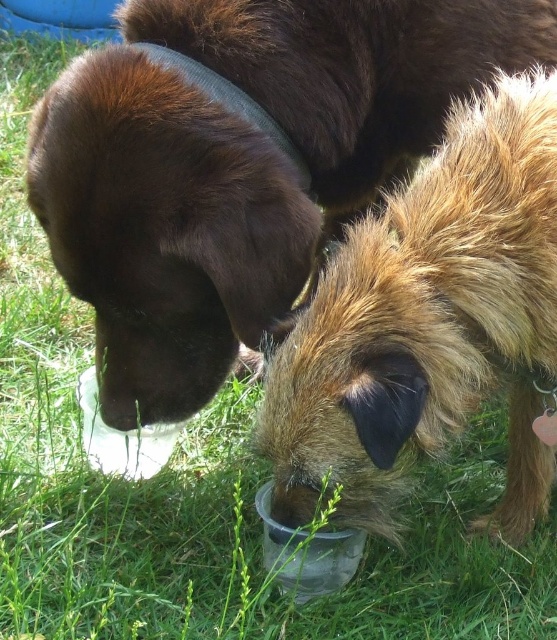
Between brown matte fur at center and fuzzy brown fur at lower center, which one is positioned higher?

Positioned higher is brown matte fur at center.

From the picture: Between brown matte fur at center and fuzzy brown fur at lower center, which one appears on the right side from the viewer's perspective?

From the viewer's perspective, fuzzy brown fur at lower center appears more on the right side.

Between point (236, 33) and point (388, 244), which one is positioned in front?

Point (388, 244)

This screenshot has width=557, height=640. Identify the location of brown matte fur at center. (240, 164).